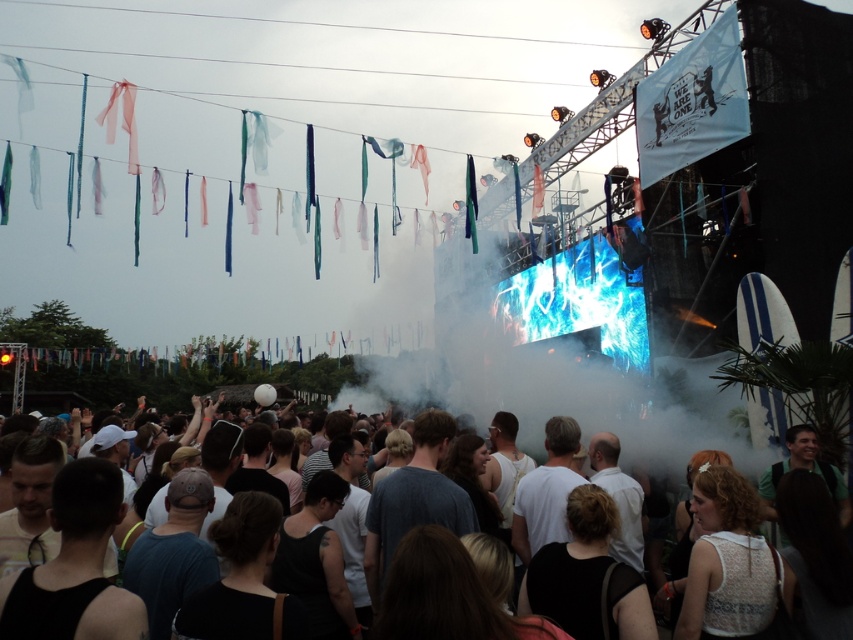
Question: Does white fog at center have a lesser width compared to dark gray cotton crowd at lower center?

Choices:
 (A) yes
 (B) no

Answer: (A)

Question: Can you confirm if white fog at center is positioned above dark gray cotton crowd at lower center?

Choices:
 (A) yes
 (B) no

Answer: (A)

Question: Does white fog at center appear under dark gray cotton crowd at lower center?

Choices:
 (A) no
 (B) yes

Answer: (A)

Question: Which point appears farthest from the camera in this image?

Choices:
 (A) (514, 538)
 (B) (619, 284)

Answer: (B)